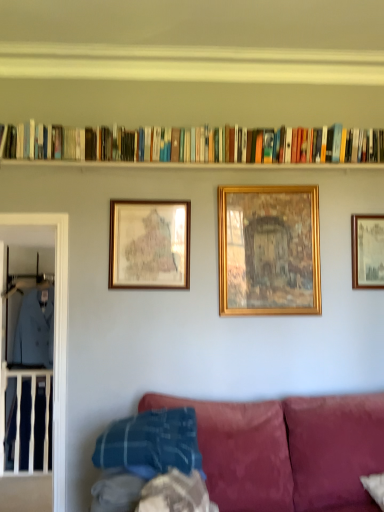
Question: From their relative heights in the image, would you say gold-framed map at center-left, arranged as the third picture frame when viewed from the right, is taller or shorter than light blue fabric at left, placed as the second clothing when sorted from left to right?

Choices:
 (A) tall
 (B) short

Answer: (B)

Question: From a real-world perspective, relative to light blue fabric at left, arranged as the 1th clothing when viewed from the right, is gold-framed map at center-left, positioned as the first picture frame in left-to-right order, vertically above or below?

Choices:
 (A) above
 (B) below

Answer: (A)

Question: Considering the real-world distances, which object is closest to the light blue fabric at left, which is the 2th clothing in right-to-left order?

Choices:
 (A) clear glass door at left
 (B) gold/gilded picture frame at center, which is the 2th picture frame from left to right
 (C) hardcover books at upper center
 (D) gold-framed picture at upper center, the third picture frame positioned from the left
 (E) gold-framed map at center-left, positioned as the first picture frame in left-to-right order

Answer: (A)

Question: Which object is the closest to the gold-framed picture at upper center, the third picture frame positioned from the left?

Choices:
 (A) light blue fabric at left, placed as the second clothing when sorted from left to right
 (B) hardcover books at upper center
 (C) clear glass door at left
 (D) gold/gilded picture frame at center, positioned as the 2th picture frame in right-to-left order
 (E) gold-framed map at center-left, arranged as the third picture frame when viewed from the right

Answer: (D)